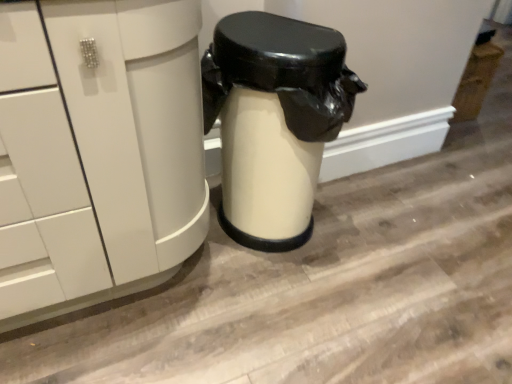
Image resolution: width=512 pixels, height=384 pixels. In order to click on free space in front of white glossy trash can at center in this screenshot , I will do `click(289, 323)`.